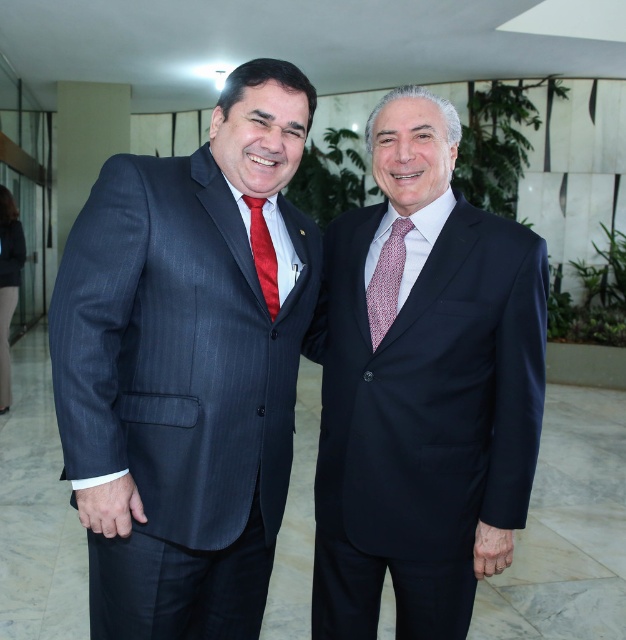
Question: Is matte black suit at center below matte red tie at center?

Choices:
 (A) yes
 (B) no

Answer: (A)

Question: Which of the following is the closest to the observer?

Choices:
 (A) pinstriped suit at left
 (B) matte red tie at center

Answer: (A)

Question: Estimate the real-world distances between objects in this image. Which object is closer to the matte black suit at center?

Choices:
 (A) pinstriped suit at left
 (B) matte red tie at center
 (C) red textured tie at center

Answer: (C)

Question: Is pinstriped suit at left to the right of matte red tie at center from the viewer's perspective?

Choices:
 (A) yes
 (B) no

Answer: (B)

Question: Which point is closer to the camera?

Choices:
 (A) (267, 228)
 (B) (143, 412)

Answer: (B)

Question: From the image, what is the correct spatial relationship of matte black suit at center in relation to matte red tie at center?

Choices:
 (A) above
 (B) below

Answer: (B)